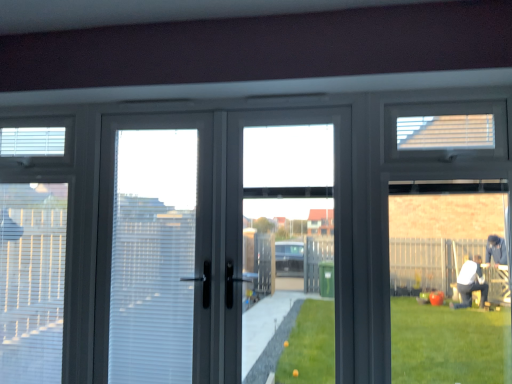
Question: Is white textured blind at left, which appears as the second blind when viewed from the left, thinner than white plastic blind at upper left, placed as the second blind when sorted from top to bottom?

Choices:
 (A) yes
 (B) no

Answer: (B)

Question: Does white textured blind at left, which appears as the second blind when viewed from the left, lie in front of white plastic blind at upper left, acting as the first blind starting from the left?

Choices:
 (A) no
 (B) yes

Answer: (B)

Question: Can you confirm if white textured blind at left, which ranks as the second blind in right-to-left order, is positioned to the left of white plastic blind at upper left, acting as the first blind starting from the left?

Choices:
 (A) yes
 (B) no

Answer: (B)

Question: Does white textured blind at left, which ranks as the second blind in front-to-back order, have a greater height compared to white plastic blind at upper left, the 3th blind in the front-to-back sequence?

Choices:
 (A) no
 (B) yes

Answer: (B)

Question: Can you confirm if white textured blind at left, which appears as the second blind when viewed from the left, is wider than white plastic blind at upper left, the 3th blind in the front-to-back sequence?

Choices:
 (A) no
 (B) yes

Answer: (B)

Question: From the image's perspective, does white textured blind at left, which appears as the second blind when viewed from the left, appear lower than white plastic blind at upper left, placed as the second blind when sorted from top to bottom?

Choices:
 (A) yes
 (B) no

Answer: (A)

Question: Is matte glass window at right surrounded by matte gray screen door at center?

Choices:
 (A) yes
 (B) no

Answer: (B)

Question: Does matte gray screen door at center have a larger size compared to matte glass window at right?

Choices:
 (A) yes
 (B) no

Answer: (A)

Question: Considering the relative sizes of matte gray screen door at center and matte glass window at right in the image provided, is matte gray screen door at center wider than matte glass window at right?

Choices:
 (A) yes
 (B) no

Answer: (A)

Question: Can you confirm if matte gray screen door at center is positioned to the left of matte glass window at right?

Choices:
 (A) yes
 (B) no

Answer: (A)

Question: Is matte gray screen door at center outside of matte glass window at right?

Choices:
 (A) no
 (B) yes

Answer: (B)

Question: Is matte gray screen door at center at the right side of matte glass window at right?

Choices:
 (A) no
 (B) yes

Answer: (A)

Question: Does white matte blind at upper right, which ranks as the first blind in top-to-bottom order, have a lesser width compared to matte gray screen door at center?

Choices:
 (A) yes
 (B) no

Answer: (A)